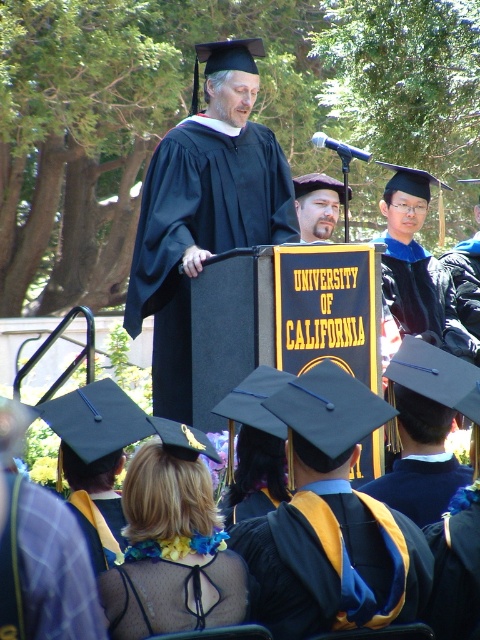
Does point (99, 577) come behind point (312, 198)?

That is False.

Is black mesh dress at center shorter than bearded man at center?

Indeed, black mesh dress at center has a lesser height compared to bearded man at center.

Is point (212, 600) positioned in front of point (304, 221)?

Yes.

In order to click on black mesh dress at center in this screenshot , I will do `click(173, 595)`.

Is matte black gown at center thinner than black mesh dress at center?

Incorrect, matte black gown at center's width is not less than black mesh dress at center's.

Which is below, matte black gown at center or black mesh dress at center?

Positioned lower is black mesh dress at center.

You are a GUI agent. You are given a task and a screenshot of the screen. Output one action in this format:
    pyautogui.click(x=<x>, y=<y>)
    Task: Click on the matte black gown at center
    Image resolution: width=480 pixels, height=640 pixels.
    Given the screenshot: What is the action you would take?
    pyautogui.click(x=204, y=209)

From the picture: Does matte black gown at center have a greater width compared to plaid wool robe at lower left?

Yes.

Does point (177, 403) come in front of point (21, 512)?

No.

Is point (254, 209) farther from viewer compared to point (85, 570)?

Yes.

Where is `matte black gown at center`? matte black gown at center is located at coordinates (204, 209).